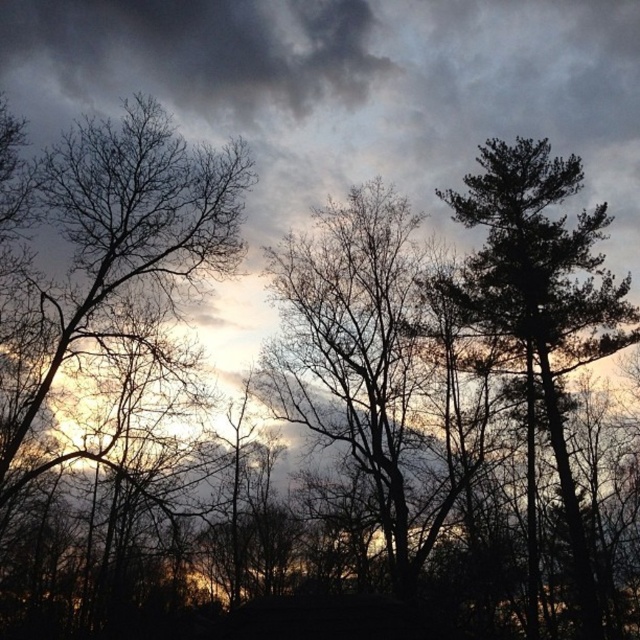
Can you confirm if silhouette bare tree at left is shorter than silhouette bark tree at center?

No.

Based on the photo, does silhouette bare tree at left appear on the right side of silhouette bark tree at center?

In fact, silhouette bare tree at left is to the left of silhouette bark tree at center.

Does point (97, 433) lie behind point (406, 509)?

Yes, point (97, 433) is farther from viewer.

Find the location of a particular element. The width and height of the screenshot is (640, 640). silhouette bare tree at left is located at coordinates (113, 300).

Does silhouette bark tree at center have a greater width compared to dark green textured tree at right?

No.

Is silhouette bark tree at center smaller than dark green textured tree at right?

Yes, silhouette bark tree at center is smaller than dark green textured tree at right.

Between point (397, 372) and point (472, 257), which one is positioned behind?

Positioned behind is point (472, 257).

Locate an element on the screen. silhouette bark tree at center is located at coordinates (362, 362).

Can you confirm if silhouette bare tree at left is thinner than dark green textured tree at right?

Incorrect, silhouette bare tree at left's width is not less than dark green textured tree at right's.

Is silhouette bare tree at left to the left of dark green textured tree at right from the viewer's perspective?

Yes, silhouette bare tree at left is to the left of dark green textured tree at right.

Who is more forward, (120,445) or (557,220)?

Positioned in front is point (120,445).

Where is `silhouette bare tree at left`? This screenshot has width=640, height=640. silhouette bare tree at left is located at coordinates (113, 300).